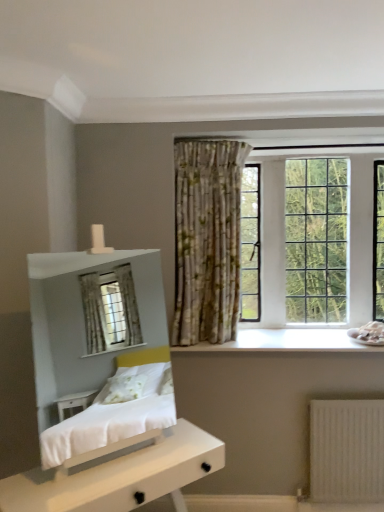
Question: From a real-world perspective, does white matte nightstand at lower left stand above clear glass window at upper right?

Choices:
 (A) yes
 (B) no

Answer: (B)

Question: Is white matte nightstand at lower left positioned in front of clear glass window at upper right?

Choices:
 (A) yes
 (B) no

Answer: (A)

Question: Can you confirm if white matte nightstand at lower left is smaller than clear glass window at upper right?

Choices:
 (A) no
 (B) yes

Answer: (A)

Question: Are white matte nightstand at lower left and clear glass window at upper right far apart?

Choices:
 (A) yes
 (B) no

Answer: (A)

Question: Is white matte nightstand at lower left oriented towards clear glass window at upper right?

Choices:
 (A) yes
 (B) no

Answer: (B)

Question: From a real-world perspective, is white matte nightstand at lower left positioned above or below clear glass window at upper right?

Choices:
 (A) below
 (B) above

Answer: (A)

Question: Which is correct: white matte nightstand at lower left is inside clear glass window at upper right, or outside of it?

Choices:
 (A) outside
 (B) inside

Answer: (A)

Question: From the image's perspective, relative to clear glass window at upper right, is white matte nightstand at lower left above or below?

Choices:
 (A) above
 (B) below

Answer: (B)

Question: Looking at their shapes, would you say white matte nightstand at lower left is wider or thinner than clear glass window at upper right?

Choices:
 (A) thin
 (B) wide

Answer: (B)

Question: From a real-world perspective, relative to white matte nightstand at lower left, is white wood at center vertically above or below?

Choices:
 (A) below
 (B) above

Answer: (B)

Question: Considering the relative positions of white wood at center and white matte nightstand at lower left in the image provided, is white wood at center to the left or to the right of white matte nightstand at lower left?

Choices:
 (A) right
 (B) left

Answer: (A)

Question: In terms of width, does white wood at center look wider or thinner when compared to white matte nightstand at lower left?

Choices:
 (A) thin
 (B) wide

Answer: (A)

Question: Considering the positions of white wood at center and white matte nightstand at lower left in the image, is white wood at center bigger or smaller than white matte nightstand at lower left?

Choices:
 (A) big
 (B) small

Answer: (B)

Question: From the image's perspective, is white matte nightstand at lower left located above or below white wood at center?

Choices:
 (A) below
 (B) above

Answer: (A)

Question: From a real-world perspective, is white matte nightstand at lower left above or below white wood at center?

Choices:
 (A) below
 (B) above

Answer: (A)